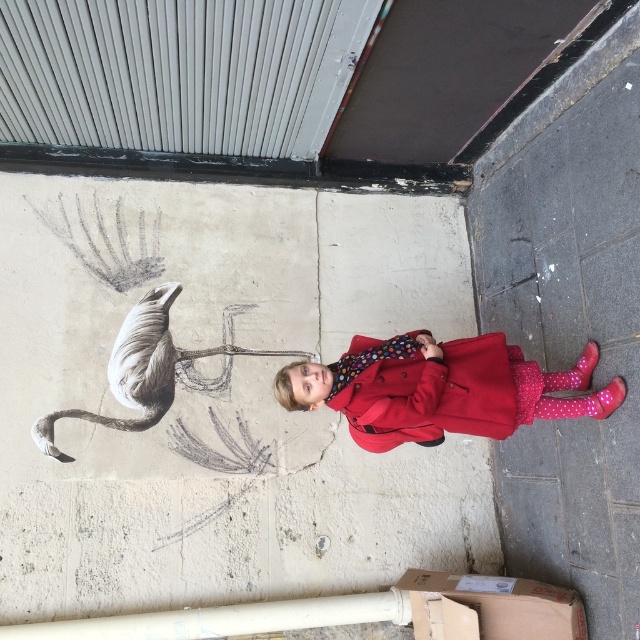
You are a painter who needs to place a ladder to reach the smooth concrete wall at center. The ladder is 1.5 meters tall. Can you safely place the ladder on the gray concrete sidewalk at lower right to reach the wall?

The smooth concrete wall at center is positioned under gray concrete sidewalk at lower right, so the ladder placed on the sidewalk can reach the wall. Since the ladder is 1.5 meters tall, it should be sufficient if the wall section needing painting is within that height range.

You are a photographer trying to capture the child in the image. You want to ensure the matte red coat at center is visible above the gray concrete sidewalk at lower right in your photo. Based on their heights, is this possible?

The gray concrete sidewalk at lower right is taller than the matte red coat at center, so the coat will be partially or fully obscured by the sidewalk in the photo.

Consider the image. You are a photographer trying to capture the child and the flamingo drawing. Since the smooth concrete wall at center and the matte red coat at center are both in your view, which object is positioned to the left of the other?

The smooth concrete wall at center is to the left of the matte red coat at center.